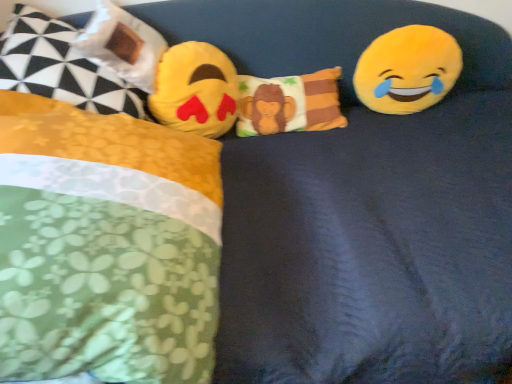
Question: In the image, is matte plastic bag at upper left, the third pillow when ordered from right to left, positioned in front of or behind fluffy cotton monkey pillow at center, the 4th pillow positioned from the left?

Choices:
 (A) behind
 (B) front

Answer: (B)

Question: Looking at their shapes, would you say matte plastic bag at upper left, the 2th pillow from the left, is wider or thinner than fluffy cotton monkey pillow at center, the 4th pillow positioned from the left?

Choices:
 (A) wide
 (B) thin

Answer: (A)

Question: Which is nearer to the fluffy cotton monkey pillow at center, the 4th pillow positioned from the left?

Choices:
 (A) matte plastic bag at upper left, the 2th pillow from the left
 (B) floral fabric pillow at left, which ranks as the fourth pillow in right-to-left order
 (C) yellow plush emoji at upper right, which is the first toy from right to left
 (D) yellow plush emoji at center, positioned as the 1th toy in left-to-right order
 (E) fluffy yellow pillow at left, arranged as the 3th pillow when viewed from the left

Answer: (D)

Question: Which object is positioned closest to the fluffy yellow pillow at left, arranged as the 3th pillow when viewed from the left?

Choices:
 (A) yellow plush emoji at center, positioned as the 1th toy in left-to-right order
 (B) floral fabric pillow at left, which ranks as the fourth pillow in right-to-left order
 (C) fluffy cotton monkey pillow at center, which is the first pillow from right to left
 (D) matte plastic bag at upper left, the third pillow when ordered from right to left
 (E) yellow plush emoji at upper right, which is the 2th toy from left to right

Answer: (B)